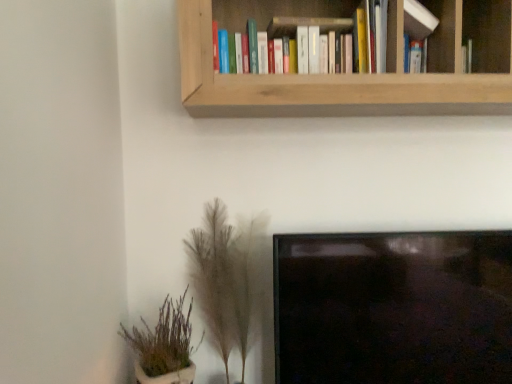
Question: Looking at their shapes, would you say white matte book at upper right, the 2th book positioned from the left, is wider or thinner than wooden bookshelf at upper center?

Choices:
 (A) wide
 (B) thin

Answer: (B)

Question: Choose the correct answer: Is white matte book at upper right, the 2th book positioned from the left, inside wooden bookshelf at upper center or outside it?

Choices:
 (A) outside
 (B) inside

Answer: (B)

Question: Which is farther from the green leafy plant at lower left, which is the 1th houseplant from left to right?

Choices:
 (A) fuzzy beige plant at lower center, the second houseplant positioned from the left
 (B) white matte book at upper right, the 2th book positioned from the left
 (C) wooden bookshelf at upper center
 (D) hardcover books at upper center, the first book in the left-to-right sequence

Answer: (B)

Question: Based on their relative distances, which object is farther from the green leafy plant at lower left, which is the 1th houseplant from left to right?

Choices:
 (A) hardcover books at upper center, placed as the 2th book when sorted from right to left
 (B) white matte book at upper right, the 2th book positioned from the left
 (C) wooden bookshelf at upper center
 (D) fuzzy beige plant at lower center, positioned as the 1th houseplant in right-to-left order

Answer: (B)